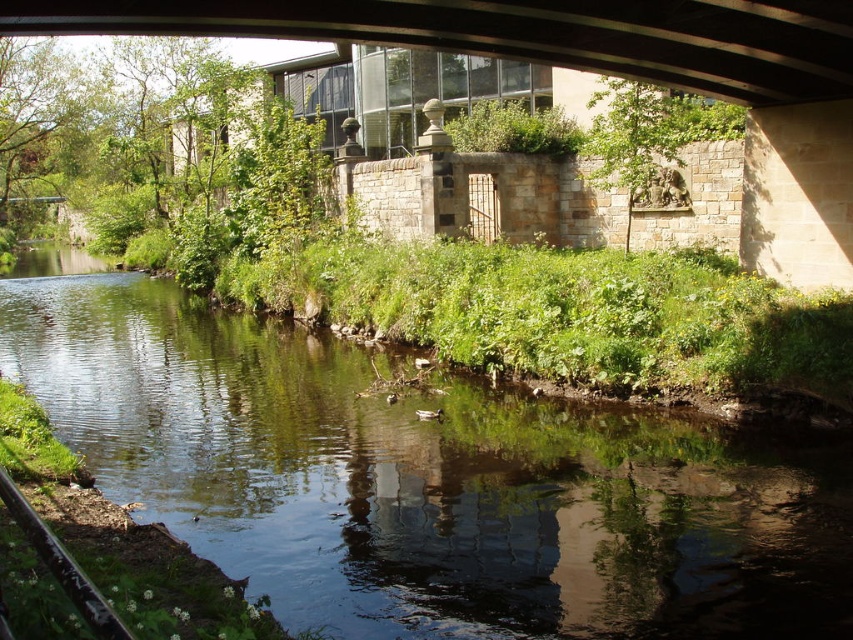
Question: Does green grassy water at lower left appear under glassy concrete bridge at upper center?

Choices:
 (A) no
 (B) yes

Answer: (B)

Question: Among these points, which one is farthest from the camera?

Choices:
 (A) (184, 512)
 (B) (595, 67)

Answer: (B)

Question: Which object is closer to the camera taking this photo?

Choices:
 (A) green grassy water at lower left
 (B) glassy concrete bridge at upper center

Answer: (A)

Question: Is green grassy water at lower left positioned behind glassy concrete bridge at upper center?

Choices:
 (A) no
 (B) yes

Answer: (A)

Question: In this image, where is green grassy water at lower left located relative to glassy concrete bridge at upper center?

Choices:
 (A) above
 (B) below

Answer: (B)

Question: Which point is farther to the camera?

Choices:
 (A) (833, 92)
 (B) (700, 420)

Answer: (A)